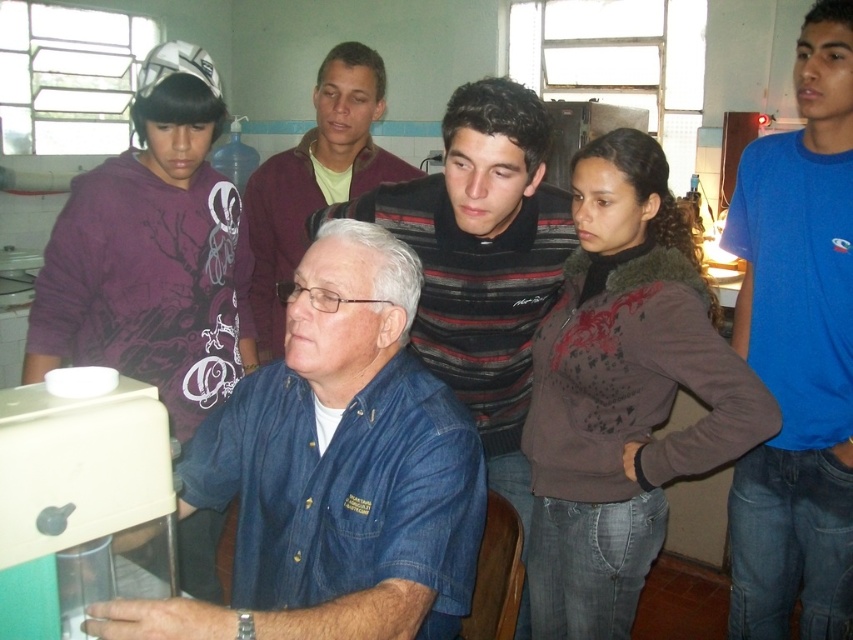
Question: Which point is farther from the camera taking this photo?

Choices:
 (A) (454, 332)
 (B) (579, 186)

Answer: (A)

Question: Which of the following is the farthest from the observer?

Choices:
 (A) matte black shirt at center
 (B) brown fuzzy jacket at center
 (C) striped sweater at upper center

Answer: (A)

Question: Can you confirm if denim shirt at center is bigger than matte black shirt at center?

Choices:
 (A) no
 (B) yes

Answer: (A)

Question: Can you confirm if denim shirt at center is positioned above brown fuzzy jacket at center?

Choices:
 (A) no
 (B) yes

Answer: (B)

Question: Considering the relative positions of blue cotton t-shirt at upper right and purple hoodie at left in the image provided, where is blue cotton t-shirt at upper right located with respect to purple hoodie at left?

Choices:
 (A) below
 (B) above

Answer: (A)

Question: Which of these objects is positioned closest to the purple hoodie at left?

Choices:
 (A) brown fuzzy jacket at center
 (B) striped sweater at upper center
 (C) denim shirt at center

Answer: (B)